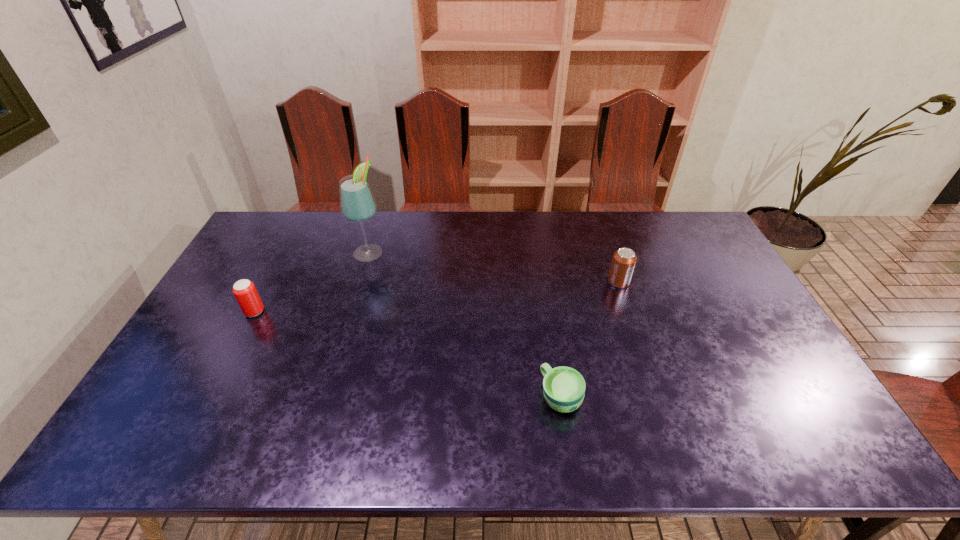
Image resolution: width=960 pixels, height=540 pixels. In order to click on the third closest object to the shortest object in this screenshot , I will do `click(244, 290)`.

Image resolution: width=960 pixels, height=540 pixels. What are the coordinates of `free location that satisfies the following two spatial constraints: 1. on the front side of the shortest object; 2. on the right side of the leftmost object` in the screenshot? It's located at (210, 397).